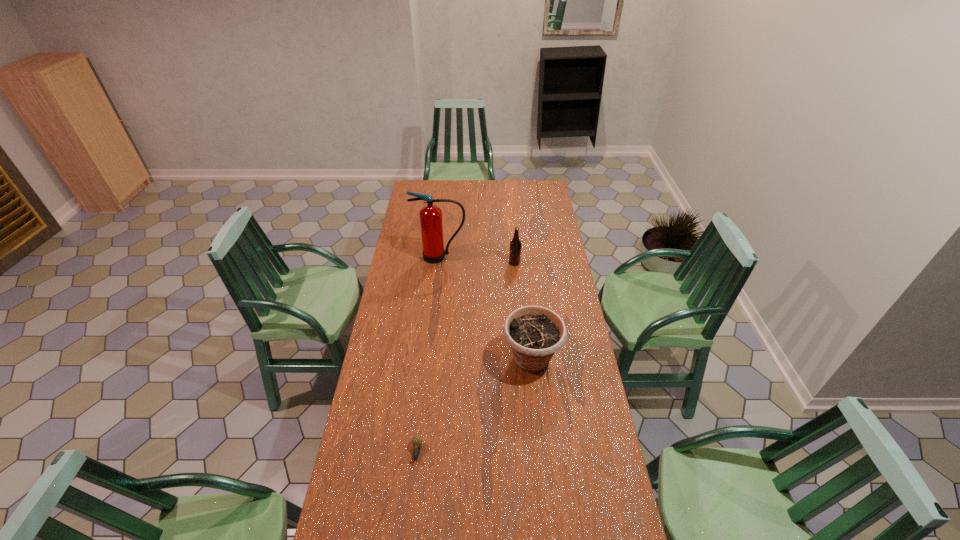
Where is `free space between the fire extinguisher and the beer bottle`? free space between the fire extinguisher and the beer bottle is located at coordinates (477, 260).

At what (x,y) coordinates should I click in order to perform the action: click on free space between the beer bottle and the escargot. Please return your answer as a coordinate pair (x, y). Looking at the image, I should click on (466, 357).

Where is `free space between the beer bottle and the tallest object`? This screenshot has height=540, width=960. free space between the beer bottle and the tallest object is located at coordinates (477, 260).

Locate an element on the screen. This screenshot has width=960, height=540. free area in between the flowerpot and the tallest object is located at coordinates (486, 308).

In order to click on free area in between the beer bottle and the fire extinguisher in this screenshot , I will do `click(477, 260)`.

Identify the location of unoccupied position between the fire extinguisher and the flowerpot. (486, 308).

Image resolution: width=960 pixels, height=540 pixels. I want to click on object that is the second closest to the fire extinguisher, so click(x=534, y=333).

Locate which object is the third closest to the flowerpot. Please provide its 2D coordinates. Your answer should be formatted as a tuple, i.e. [(x, y)], where the tuple contains the x and y coordinates of a point satisfying the conditions above.

[(431, 222)]

I want to click on vacant position in the image that satisfies the following two spatial constraints: 1. on the front side of the tallest object; 2. on the left side of the third farthest object, so click(430, 359).

This screenshot has width=960, height=540. I want to click on free spot that satisfies the following two spatial constraints: 1. on the label of the beer bottle; 2. on the front-facing side of the escargot, so click(x=532, y=452).